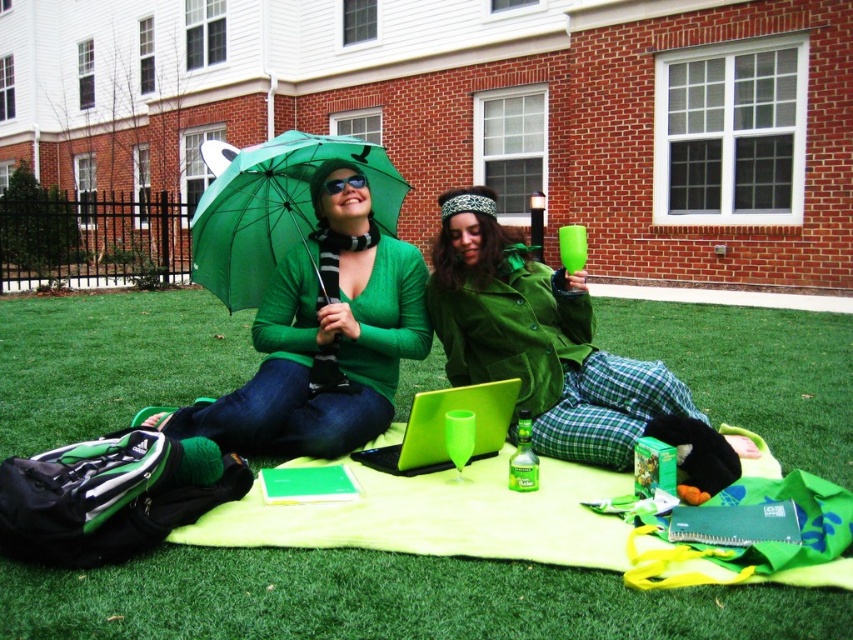
You are a photographer trying to capture a closeup shot of the matte green laptop at center. The matte green sweater at center is blocking your view. Can you tell me which object you need to move to get a clear shot of the laptop?

The matte green sweater at center is larger in size than the matte green laptop at center, so you need to move the matte green sweater at center to get a clear shot of the laptop.

In the scene shown: You are a photographer taking a picture of the matte green sweater at center and the matte green laptop at center. Which object should you focus on first if you want to capture both in the frame without moving the camera?

The matte green sweater at center is much taller than the matte green laptop at center, so you should focus on the taller object first to ensure it fits within the frame.

In the scene shown: You are a photographer trying to capture a clear photo of the matte green laptop at center. However, the matte green sweater at center is blocking your view. Can you adjust your position so that the sweater is no longer in the way?

The matte green laptop at center is behind the matte green sweater at center, so moving your camera position slightly forward or to the side should allow you to see the laptop without the sweater blocking it.